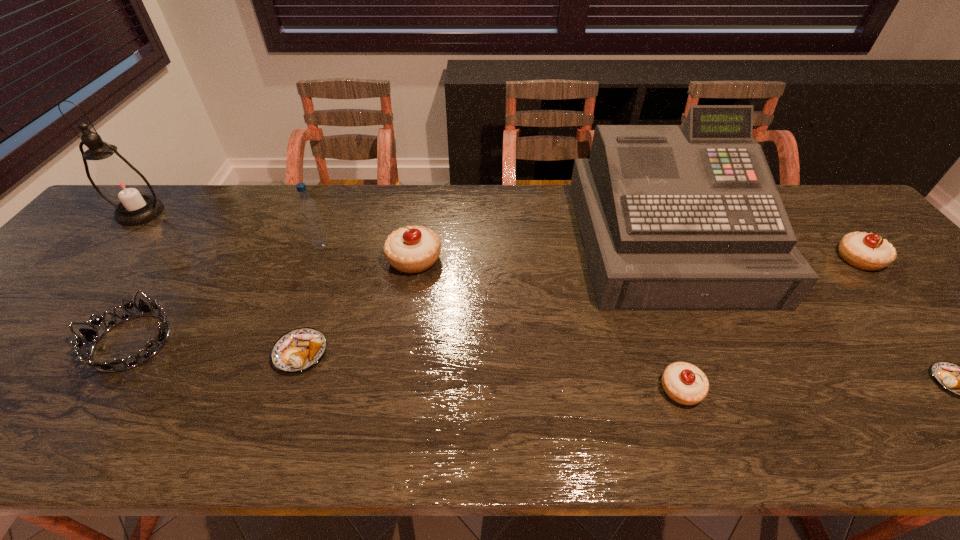
I want to click on oil lamp, so click(123, 186).

The image size is (960, 540). Identify the location of gray cash register. (688, 217).

Identify the location of the seventh shortest object. The height and width of the screenshot is (540, 960). (309, 211).

Identify the location of water bottle. (309, 211).

The image size is (960, 540). Find the location of `the tallest pastry`. the tallest pastry is located at coordinates (412, 249).

In order to click on the sixth shortest object in this screenshot , I will do `click(412, 249)`.

Image resolution: width=960 pixels, height=540 pixels. I want to click on the second smallest beige pastry, so click(867, 251).

I want to click on the second tallest pastry, so click(867, 251).

Locate an element on the screen. The image size is (960, 540). tiara is located at coordinates point(91,336).

The image size is (960, 540). In order to click on the nearest beige pastry in this screenshot , I will do `click(684, 383)`.